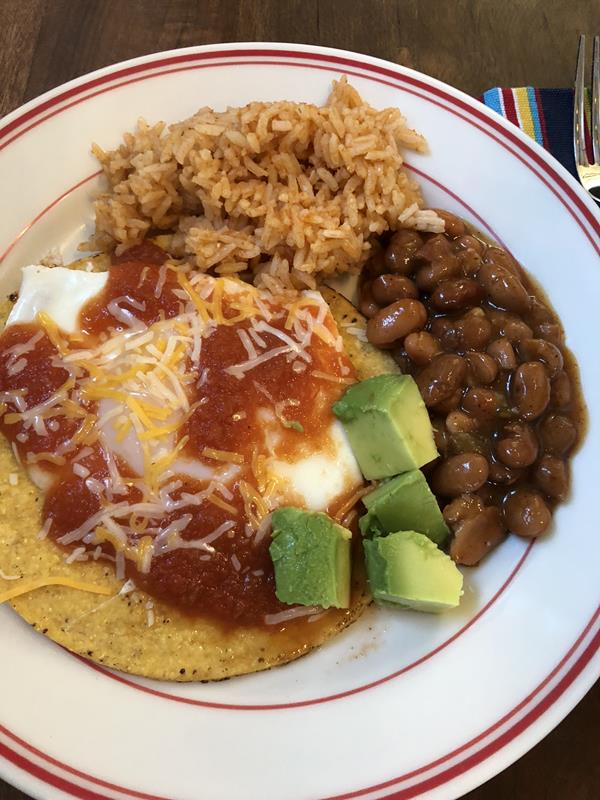
Identify the location of fork. (586, 114).